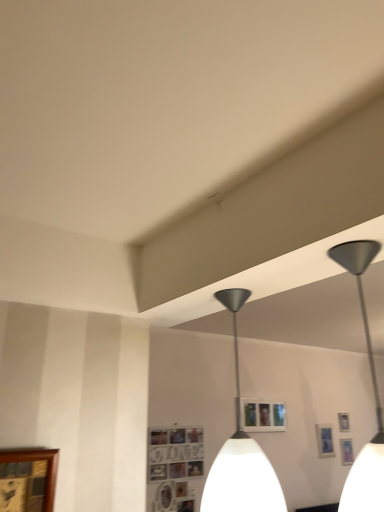
Question: Considering the relative positions of wooden picture frame at lower left, the 1th picture frame viewed from the left, and metallic silver picture frame at upper right, arranged as the third picture frame when viewed from the front, in the image provided, is wooden picture frame at lower left, the 1th picture frame viewed from the left, to the right of metallic silver picture frame at upper right, arranged as the third picture frame when viewed from the front, from the viewer's perspective?

Choices:
 (A) no
 (B) yes

Answer: (A)

Question: From a real-world perspective, is wooden picture frame at lower left, which appears as the fourth picture frame when viewed from the back, over metallic silver picture frame at upper right, arranged as the third picture frame when viewed from the front?

Choices:
 (A) yes
 (B) no

Answer: (A)

Question: Can you confirm if wooden picture frame at lower left, marked as the 4th picture frame in a bottom-to-top arrangement, is thinner than metallic silver picture frame at upper right, arranged as the third picture frame when viewed from the front?

Choices:
 (A) yes
 (B) no

Answer: (B)

Question: Could you tell me if wooden picture frame at lower left, the 1th picture frame viewed from the left, is turned towards metallic silver picture frame at upper right, the first picture frame when ordered from bottom to top?

Choices:
 (A) no
 (B) yes

Answer: (A)

Question: Can you confirm if wooden picture frame at lower left, marked as the 4th picture frame in a right-to-left arrangement, is bigger than metallic silver picture frame at upper right, arranged as the 4th picture frame when viewed from the top?

Choices:
 (A) no
 (B) yes

Answer: (B)

Question: From a real-world perspective, is metallic gray pendant light at center above or below metallic silver picture frame at upper right, marked as the 2th picture frame in a back-to-front arrangement?

Choices:
 (A) above
 (B) below

Answer: (A)

Question: Considering the relative positions of metallic gray pendant light at center and metallic silver picture frame at upper right, the fourth picture frame viewed from the left, in the image provided, is metallic gray pendant light at center to the left or to the right of metallic silver picture frame at upper right, the fourth picture frame viewed from the left,?

Choices:
 (A) right
 (B) left

Answer: (B)

Question: Relative to metallic silver picture frame at upper right, arranged as the 4th picture frame when viewed from the top, is metallic gray pendant light at center in front or behind?

Choices:
 (A) front
 (B) behind

Answer: (A)

Question: In terms of width, does metallic gray pendant light at center look wider or thinner when compared to metallic silver picture frame at upper right, the first picture frame when ordered from bottom to top?

Choices:
 (A) wide
 (B) thin

Answer: (A)

Question: From a real-world perspective, is wooden picture frame at lower left, which appears as the fourth picture frame when viewed from the back, physically located above or below metallic silver picture frame at upper right, marked as the 2th picture frame in a back-to-front arrangement?

Choices:
 (A) below
 (B) above

Answer: (B)

Question: Is wooden picture frame at lower left, positioned as the 1th picture frame in top-to-bottom order, bigger or smaller than metallic silver picture frame at upper right, arranged as the third picture frame when viewed from the front?

Choices:
 (A) small
 (B) big

Answer: (B)

Question: In the image, is wooden picture frame at lower left, the 1th picture frame viewed from the left, positioned in front of or behind metallic silver picture frame at upper right, marked as the 2th picture frame in a back-to-front arrangement?

Choices:
 (A) behind
 (B) front

Answer: (B)

Question: Considering the positions of wooden picture frame at lower left, which appears as the fourth picture frame when viewed from the back, and metallic silver picture frame at upper right, the 1th picture frame in the right-to-left sequence, in the image, is wooden picture frame at lower left, which appears as the fourth picture frame when viewed from the back, taller or shorter than metallic silver picture frame at upper right, the 1th picture frame in the right-to-left sequence,?

Choices:
 (A) tall
 (B) short

Answer: (A)

Question: In terms of width, does metallic silver picture frame at upper right, which is the third picture frame from left to right, look wider or thinner when compared to metallic gray pendant light at center?

Choices:
 (A) thin
 (B) wide

Answer: (A)

Question: Based on their positions, is metallic silver picture frame at upper right, the first picture frame viewed from the back, located to the left or right of metallic gray pendant light at center?

Choices:
 (A) right
 (B) left

Answer: (A)